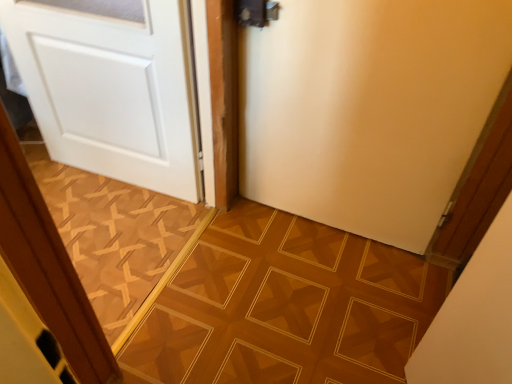
Question: In terms of height, does wooden parquet floor at center, acting as the 1th ceramic tile starting from the right, look taller or shorter compared to white matte door at left, which is the 2th door in right-to-left order?

Choices:
 (A) short
 (B) tall

Answer: (A)

Question: Considering the positions of point (121, 354) and point (158, 177), is point (121, 354) closer or farther from the camera than point (158, 177)?

Choices:
 (A) farther
 (B) closer

Answer: (B)

Question: Which object is the farthest from the white matte door at center, arranged as the 1th door when viewed from the right?

Choices:
 (A) wooden parquet floor at center, acting as the 1th ceramic tile starting from the right
 (B) white matte door at left, which is the first door in left-to-right order
 (C) brown textured tile at center, arranged as the first ceramic tile when viewed from the left

Answer: (C)

Question: Estimate the real-world distances between objects in this image. Which object is closer to the white matte door at center, arranged as the 1th door when viewed from the right?

Choices:
 (A) white matte door at left, which is the first door in left-to-right order
 (B) wooden parquet floor at center, marked as the 2th ceramic tile in a left-to-right arrangement
 (C) brown textured tile at center, positioned as the 2th ceramic tile in right-to-left order

Answer: (B)